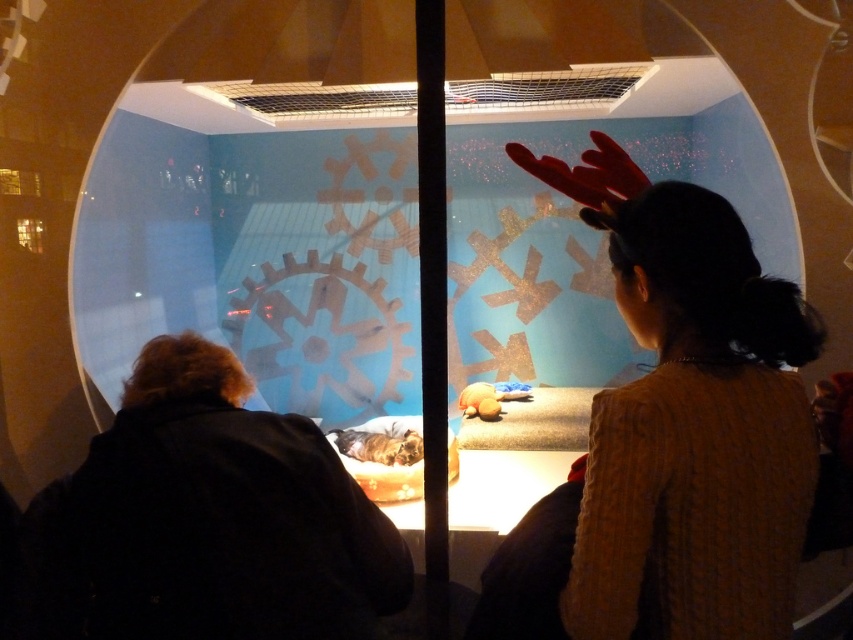
Question: Is knitted sweater at upper right positioned in front of rubber glove at upper center?

Choices:
 (A) yes
 (B) no

Answer: (A)

Question: Which of the following is the closest to the observer?

Choices:
 (A) (741, 490)
 (B) (637, 177)

Answer: (A)

Question: Is knitted sweater at upper right thinner than rubber glove at upper center?

Choices:
 (A) yes
 (B) no

Answer: (B)

Question: Which point is closer to the camera?

Choices:
 (A) (621, 198)
 (B) (753, 509)

Answer: (B)

Question: Which point appears farthest from the camera in this image?

Choices:
 (A) (634, 508)
 (B) (616, 164)

Answer: (B)

Question: Does knitted sweater at upper right come behind rubber glove at upper center?

Choices:
 (A) yes
 (B) no

Answer: (B)